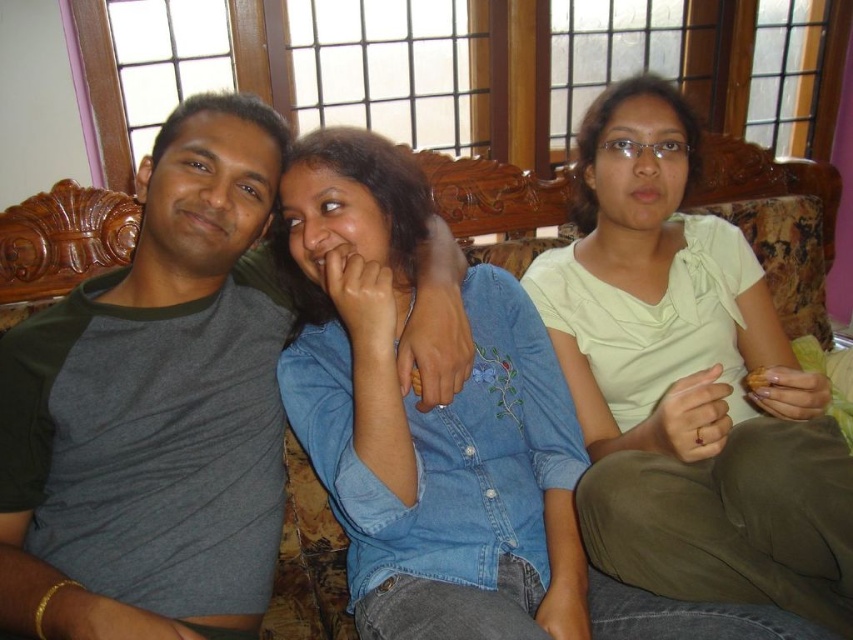
Question: Which point is farther to the camera?

Choices:
 (A) (141, 332)
 (B) (758, 468)

Answer: (A)

Question: Considering the real-world distances, which object is farthest from the gray cotton t-shirt at left?

Choices:
 (A) denim shirt at center
 (B) light green fabric shirt at center

Answer: (B)

Question: Is light green fabric shirt at center behind denim shirt at center?

Choices:
 (A) no
 (B) yes

Answer: (B)

Question: Considering the relative positions of light green fabric shirt at center and denim shirt at center in the image provided, where is light green fabric shirt at center located with respect to denim shirt at center?

Choices:
 (A) left
 (B) right

Answer: (B)

Question: Which point appears closest to the camera in this image?

Choices:
 (A) (756, 305)
 (B) (480, 541)
 (C) (120, 474)

Answer: (C)

Question: Does gray cotton t-shirt at left appear under light green fabric shirt at center?

Choices:
 (A) yes
 (B) no

Answer: (A)